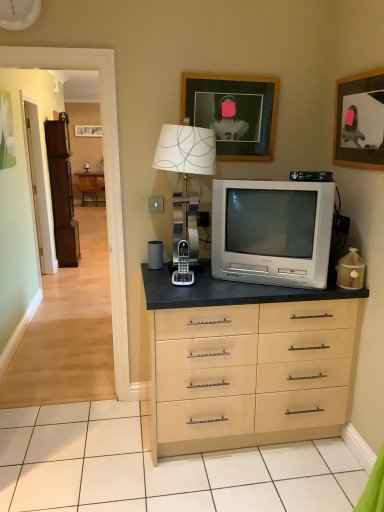
Question: Is white matte clock at upper left a part of silver metallic television at center?

Choices:
 (A) no
 (B) yes

Answer: (A)

Question: Is silver metallic television at center in contact with white matte clock at upper left?

Choices:
 (A) no
 (B) yes

Answer: (A)

Question: From the image's perspective, is silver metallic television at center over white matte clock at upper left?

Choices:
 (A) no
 (B) yes

Answer: (A)

Question: From the image's perspective, is silver metallic television at center under white matte clock at upper left?

Choices:
 (A) yes
 (B) no

Answer: (A)

Question: Does silver metallic television at center appear on the left side of white matte clock at upper left?

Choices:
 (A) no
 (B) yes

Answer: (A)

Question: Is slate gray matte speaker at center in front of or behind brown wooden armoire at left in the image?

Choices:
 (A) front
 (B) behind

Answer: (A)

Question: From a real-world perspective, is slate gray matte speaker at center physically located above or below brown wooden armoire at left?

Choices:
 (A) below
 (B) above

Answer: (B)

Question: Considering the positions of slate gray matte speaker at center and brown wooden armoire at left in the image, is slate gray matte speaker at center taller or shorter than brown wooden armoire at left?

Choices:
 (A) short
 (B) tall

Answer: (A)

Question: Which is correct: slate gray matte speaker at center is inside brown wooden armoire at left, or outside of it?

Choices:
 (A) outside
 (B) inside

Answer: (A)

Question: Is wooden picture frame at upper right, the 1th picture frame viewed from the right, to the left or to the right of white matte clock at upper left in the image?

Choices:
 (A) right
 (B) left

Answer: (A)

Question: Considering the positions of point (352, 136) and point (8, 5), is point (352, 136) closer or farther from the camera than point (8, 5)?

Choices:
 (A) farther
 (B) closer

Answer: (A)

Question: In terms of size, does wooden picture frame at upper right, marked as the 2th picture frame in a left-to-right arrangement, appear bigger or smaller than white matte clock at upper left?

Choices:
 (A) small
 (B) big

Answer: (B)

Question: Is wooden picture frame at upper right, the 1th picture frame viewed from the right, inside or outside of white matte clock at upper left?

Choices:
 (A) inside
 (B) outside

Answer: (B)

Question: From a real-world perspective, is wooden picture frame at upper right, marked as the 2th picture frame in a left-to-right arrangement, physically located above or below metallic silver table lamp at center?

Choices:
 (A) below
 (B) above

Answer: (B)

Question: Is wooden picture frame at upper right, the 1th picture frame viewed from the right, wider or thinner than metallic silver table lamp at center?

Choices:
 (A) thin
 (B) wide

Answer: (A)